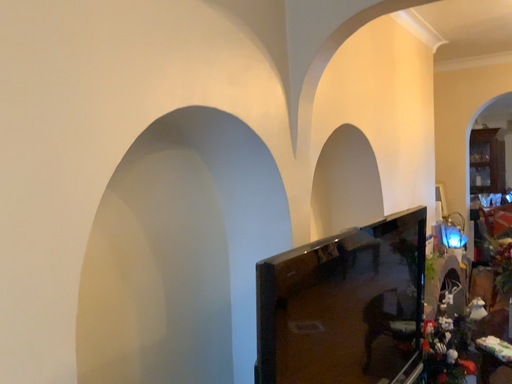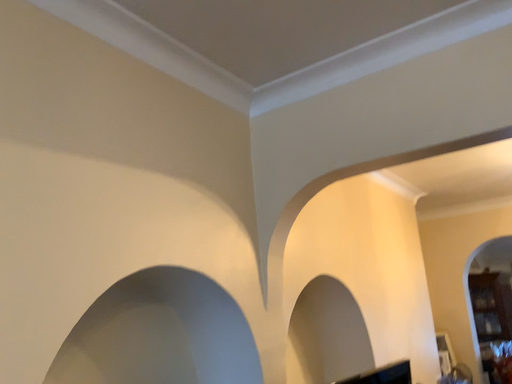
Question: Which way did the camera rotate in the video?

Choices:
 (A) rotated upward
 (B) rotated downward

Answer: (A)